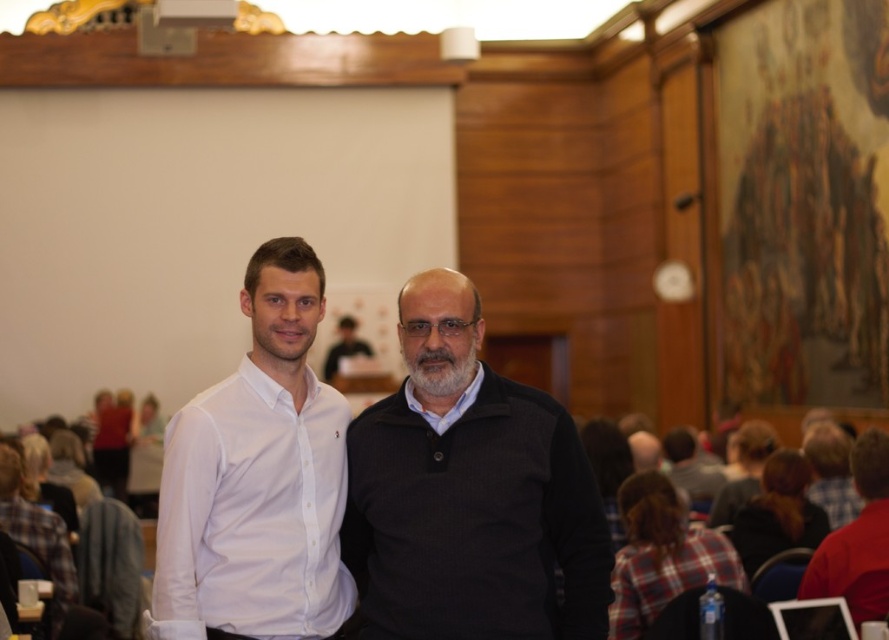
Can you confirm if white matte shirt at center is positioned above matte black shirt at center?

Incorrect, white matte shirt at center is not positioned above matte black shirt at center.

Does white matte shirt at center have a smaller size compared to matte black shirt at center?

Incorrect, white matte shirt at center is not smaller in size than matte black shirt at center.

The width and height of the screenshot is (889, 640). Describe the element at coordinates (257, 477) in the screenshot. I see `white matte shirt at center` at that location.

Locate an element on the screen. Image resolution: width=889 pixels, height=640 pixels. white matte shirt at center is located at coordinates (257, 477).

Is dark gray sweater at center further to camera compared to red matte shirt at lower right?

No, it is not.

Between dark gray sweater at center and red matte shirt at lower right, which one has less height?

Standing shorter between the two is red matte shirt at lower right.

Is point (383, 600) positioned in front of point (854, 456)?

That is True.

At what (x,y) coordinates should I click in order to perform the action: click on dark gray sweater at center. Please return your answer as a coordinate pair (x, y). Looking at the image, I should click on (469, 492).

Between point (859, 525) and point (333, 360), which one is positioned in front?

Point (859, 525) is more forward.

Can you confirm if red matte shirt at lower right is positioned below matte black shirt at center?

Yes.

Between point (813, 570) and point (325, 365), which one is positioned behind?

Point (325, 365)

Locate an element on the screen. red matte shirt at lower right is located at coordinates (857, 540).